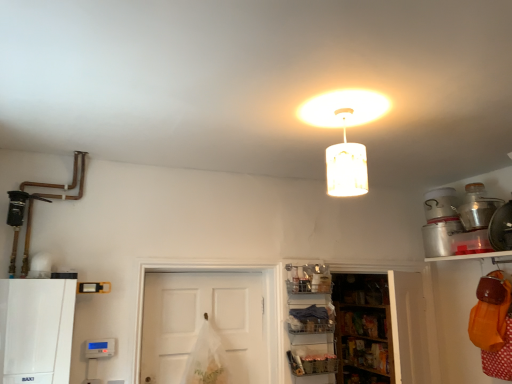
Describe the element at coordinates (310, 320) in the screenshot. I see `white plastic basket at lower center, arranged as the 1th shelf when viewed from the left` at that location.

Describe the element at coordinates (455, 315) in the screenshot. The width and height of the screenshot is (512, 384). I see `orange fabric bag at lower right, which ranks as the 4th shelf in left-to-right order` at that location.

Find the location of a particular element. The image size is (512, 384). white matte cabinet at lower left is located at coordinates (36, 330).

From the picture: Is metallic silver shelf at lower right, marked as the 3th shelf in a right-to-left arrangement, aimed at white matte door at center?

No, metallic silver shelf at lower right, marked as the 3th shelf in a right-to-left arrangement, is not turned towards white matte door at center.

Which of these two, metallic silver shelf at lower right, marked as the 3th shelf in a right-to-left arrangement, or white matte door at center, stands taller?

white matte door at center is taller.

From a real-world perspective, is metallic silver shelf at lower right, marked as the 3th shelf in a right-to-left arrangement, located higher than white matte door at center?

Actually, metallic silver shelf at lower right, marked as the 3th shelf in a right-to-left arrangement, is physically below white matte door at center in the real world.

Between white plastic basket at lower center, arranged as the 4th shelf when viewed from the right, and orange fabric bag at lower right, which ranks as the 4th shelf in left-to-right order, which one has smaller size?

With smaller size is white plastic basket at lower center, arranged as the 4th shelf when viewed from the right.

Could you tell me if white plastic basket at lower center, arranged as the 1th shelf when viewed from the left, is facing orange fabric bag at lower right, the 1th shelf when ordered from right to left?

No, white plastic basket at lower center, arranged as the 1th shelf when viewed from the left, is not aimed at orange fabric bag at lower right, the 1th shelf when ordered from right to left.

How many degrees apart are the facing directions of white plastic basket at lower center, arranged as the 1th shelf when viewed from the left, and orange fabric bag at lower right, the 1th shelf when ordered from right to left?

They differ by 90.6 degrees in their facing directions.

Which is more distant, (319, 315) or (401, 381)?

The point (319, 315) is farther from the camera.

Who is bigger, white plastic basket at lower center, arranged as the 4th shelf when viewed from the right, or wooden shelves at lower center, which appears as the 2th shelf when viewed from the right?

wooden shelves at lower center, which appears as the 2th shelf when viewed from the right.

In the scene shown: From a real-world perspective, which is physically above, white plastic basket at lower center, arranged as the 4th shelf when viewed from the right, or wooden shelves at lower center, which appears as the 2th shelf when viewed from the right?

white plastic basket at lower center, arranged as the 4th shelf when viewed from the right, is physically above.

From a real-world perspective, starting from the white plastic basket at lower center, arranged as the 4th shelf when viewed from the right, which shelf is the 2nd one below it? Please provide its 2D coordinates.

[(380, 327)]

Which object is positioned more to the left, white matte door at center or metallic silver shelf at lower right, the second shelf from the left?

From the viewer's perspective, white matte door at center appears more on the left side.

Is white matte door at center touching metallic silver shelf at lower right, marked as the 3th shelf in a right-to-left arrangement?

white matte door at center is not next to metallic silver shelf at lower right, marked as the 3th shelf in a right-to-left arrangement, and they're not touching.

From the image's perspective, which is below, white matte door at center or metallic silver shelf at lower right, marked as the 3th shelf in a right-to-left arrangement?

From the image's view, metallic silver shelf at lower right, marked as the 3th shelf in a right-to-left arrangement, is below.

Based on the photo, does white matte door at center turn towards metallic silver shelf at lower right, marked as the 3th shelf in a right-to-left arrangement?

No, white matte door at center does not turn towards metallic silver shelf at lower right, marked as the 3th shelf in a right-to-left arrangement.

Does white matte cabinet at lower left have a smaller size compared to metallic silver shelf at lower right, the second shelf from the left?

Incorrect, white matte cabinet at lower left is not smaller in size than metallic silver shelf at lower right, the second shelf from the left.

Is the surface of white matte cabinet at lower left in direct contact with metallic silver shelf at lower right, marked as the 3th shelf in a right-to-left arrangement?

No, white matte cabinet at lower left is not touching metallic silver shelf at lower right, marked as the 3th shelf in a right-to-left arrangement.

Would you say white matte cabinet at lower left is inside or outside metallic silver shelf at lower right, the second shelf from the left?

white matte cabinet at lower left lies outside metallic silver shelf at lower right, the second shelf from the left.

In the scene shown: Between white matte cabinet at lower left and metallic silver shelf at lower right, the second shelf from the left, which one has larger width?

white matte cabinet at lower left is wider.

From a real-world perspective, is orange fabric bag at lower right, the 1th shelf when ordered from right to left, beneath metallic silver container at upper right?

Yes, from a real-world perspective, orange fabric bag at lower right, the 1th shelf when ordered from right to left, is under metallic silver container at upper right.

Identify the location of appliance behind the orange fabric bag at lower right, the 1th shelf when ordered from right to left. This screenshot has height=384, width=512. (440, 204).

Is orange fabric bag at lower right, which ranks as the 4th shelf in left-to-right order, facing away from metallic silver container at upper right?

That's not correct — orange fabric bag at lower right, which ranks as the 4th shelf in left-to-right order, is not looking away from metallic silver container at upper right.

How far apart are orange fabric bag at lower right, the 1th shelf when ordered from right to left, and metallic silver container at upper right?

orange fabric bag at lower right, the 1th shelf when ordered from right to left, is 26.26 inches from metallic silver container at upper right.

Can you tell me how much metallic silver container at upper right and white matte door at center differ in facing direction?

The angular difference between metallic silver container at upper right and white matte door at center is 91.3 degrees.

Is metallic silver container at upper right in front of white matte door at center?

No, it is not.

From a real-world perspective, between metallic silver container at upper right and white matte door at center, who is vertically higher?

In real-world perspective, metallic silver container at upper right is above.

I want to click on door that is in front of the metallic silver shelf at lower right, marked as the 3th shelf in a right-to-left arrangement, so click(x=202, y=321).

Identify the location of shelf that is the 3rd object to the left of the orange fabric bag at lower right, the 1th shelf when ordered from right to left, starting at the anchor. The height and width of the screenshot is (384, 512). (310, 320).

Looking at the image, which one is located further to orange fabric bag at lower right, the 1th shelf when ordered from right to left, white matte lampshade at upper center or metallic silver shelf at lower right, the second shelf from the left?

white matte lampshade at upper center is further to orange fabric bag at lower right, the 1th shelf when ordered from right to left.

From the image, which object appears to be farther from white matte lampshade at upper center, wooden shelves at lower center, which appears as the 2th shelf when viewed from the right, or metallic silver container at upper right?

Among the two, wooden shelves at lower center, which appears as the 2th shelf when viewed from the right, is located further to white matte lampshade at upper center.

Considering their positions, is white matte cabinet at lower left positioned further to metallic silver container at upper right than metallic silver shelf at lower right, marked as the 3th shelf in a right-to-left arrangement?

The object further to metallic silver container at upper right is white matte cabinet at lower left.

Looking at the image, which one is located further to white plastic basket at lower center, arranged as the 1th shelf when viewed from the left, white matte lampshade at upper center or metallic silver container at upper right?

white matte lampshade at upper center is positioned further to the anchor white plastic basket at lower center, arranged as the 1th shelf when viewed from the left.

In the scene shown: Which object lies nearer to the anchor point white matte lampshade at upper center, wooden shelves at lower center, which appears as the 2th shelf when viewed from the right, or white matte cabinet at lower left?

The object closer to white matte lampshade at upper center is white matte cabinet at lower left.

When comparing their distances from white matte door at center, does white matte lampshade at upper center or orange fabric bag at lower right, the 1th shelf when ordered from right to left, seem closer?

Based on the image, white matte lampshade at upper center appears to be nearer to white matte door at center.

Based on their spatial positions, is white plastic basket at lower center, arranged as the 1th shelf when viewed from the left, or white matte cabinet at lower left further from wooden shelves at lower center, which appears as the 2th shelf when viewed from the right?

white matte cabinet at lower left is further to wooden shelves at lower center, which appears as the 2th shelf when viewed from the right.

Looking at the image, which one is located further to wooden shelves at lower center, the third shelf in the left-to-right sequence, metallic silver container at upper right or metallic silver shelf at lower right, the second shelf from the left?

metallic silver container at upper right is further to wooden shelves at lower center, the third shelf in the left-to-right sequence.

Locate an element on the screen. The height and width of the screenshot is (384, 512). lamp between white matte cabinet at lower left and metallic silver container at upper right is located at coordinates (346, 164).

What are the coordinates of `lamp between metallic silver shelf at lower right, marked as the 3th shelf in a right-to-left arrangement, and orange fabric bag at lower right, which ranks as the 4th shelf in left-to-right order, from left to right` in the screenshot? It's located at tap(346, 164).

Where is `shelf between white matte cabinet at lower left and metallic silver shelf at lower right, marked as the 3th shelf in a right-to-left arrangement, from left to right`? The height and width of the screenshot is (384, 512). shelf between white matte cabinet at lower left and metallic silver shelf at lower right, marked as the 3th shelf in a right-to-left arrangement, from left to right is located at coordinates (310, 320).

Where is `lamp between white matte door at center and metallic silver container at upper right from left to right`? lamp between white matte door at center and metallic silver container at upper right from left to right is located at coordinates (346, 164).